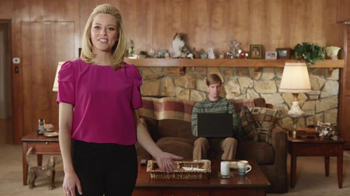
At what (x,y) coordinates should I click in order to perform the action: click on lampshade. Please return your answer as a coordinate pair (x, y). The height and width of the screenshot is (196, 350). Looking at the image, I should click on (297, 78).